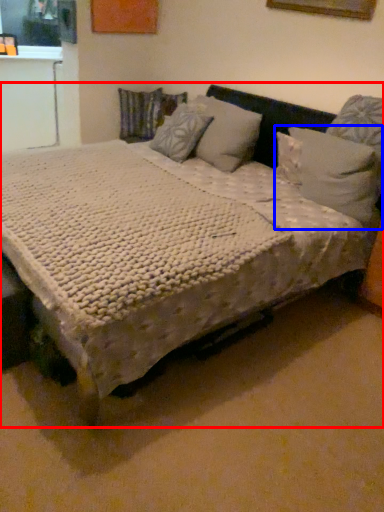
Question: Which object is closer to the camera taking this photo, bed (highlighted by a red box) or pillow (highlighted by a blue box)?

Choices:
 (A) bed
 (B) pillow

Answer: (A)